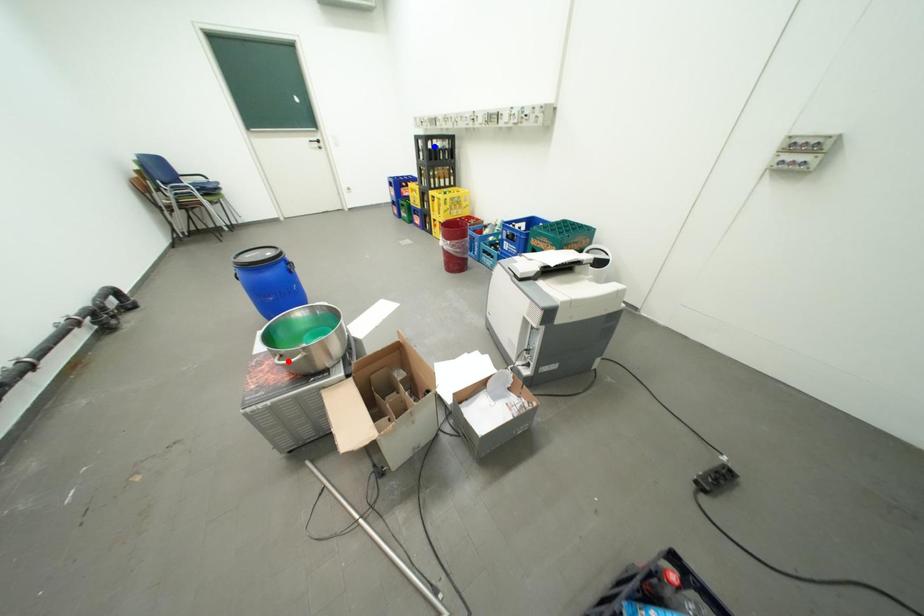
Question: In the image, two points are highlighted. Which point is nearer to the camera? Reply with the corresponding letter.

Choices:
 (A) blue point
 (B) red point

Answer: (B)